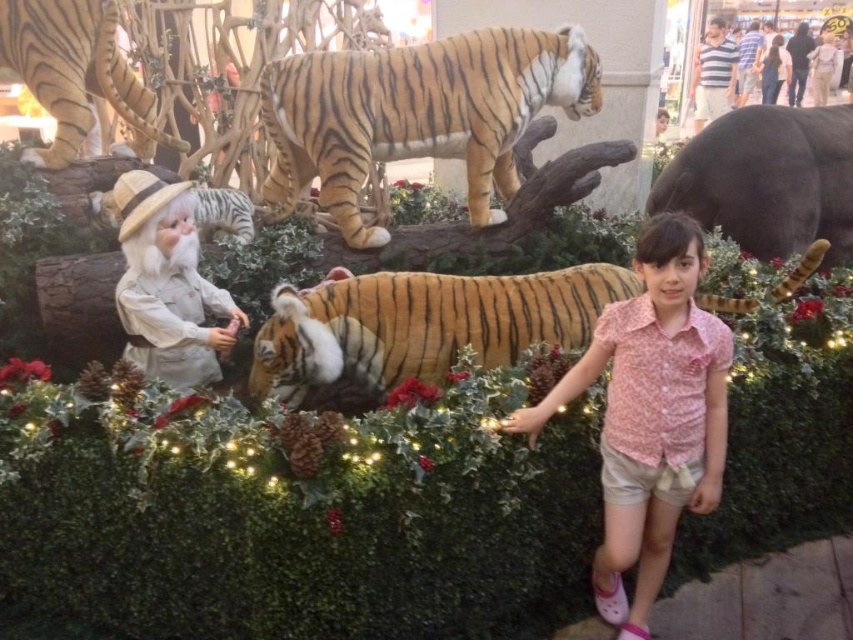
You are a visitor at the festive display and want to take a photo of the pink floral shirt at center and the smooth gray elephant at upper right. Which object will appear larger in the photo?

The pink floral shirt at center will appear larger in the photo because it is taller than the smooth gray elephant at upper right.

You are a photographer at the scene. You need to place a spotlight on the pink floral shirt at center. The spotlight can only be placed at the point marked by the coordinate point (650, 416). Will the spotlight hit the pink floral shirt at center?

Yes, the point (650, 416) marks the pink floral shirt at center, so placing the spotlight there will directly illuminate the pink floral shirt at center.